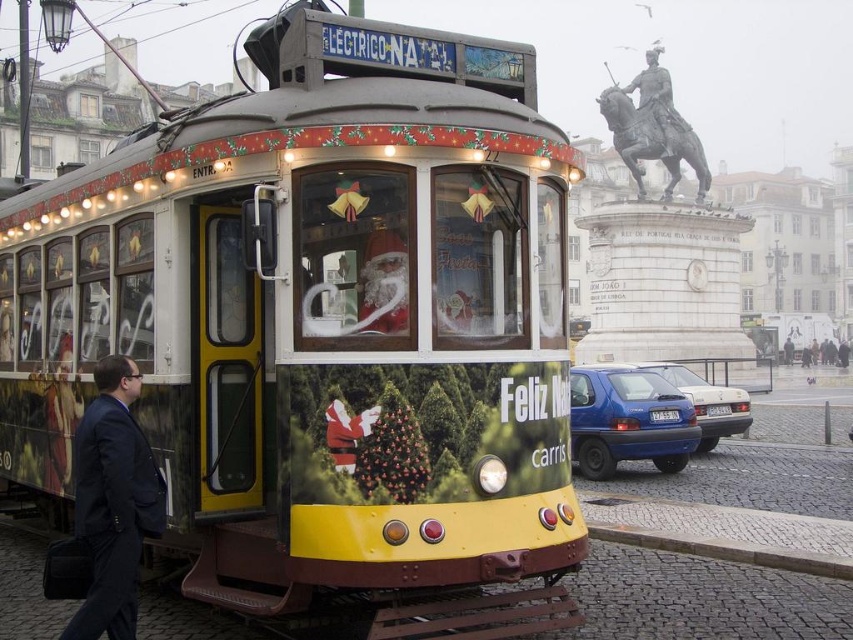
You are a photographer standing in front of the festive streetcar. You want to take a photo that includes both the dark blue suit at left and the red velvet santa at center. Based on their positions, which object should appear higher in the photo?

Answer: The red velvet santa at center appears higher in the photo because the dark blue suit at left is positioned below it.

You are a photographer planning to capture both the bronze statue of man on horse at upper center and the red velvet santa at center in a single frame. Which object should you position closer to the camera to ensure both are fully visible without cropping?

Position the bronze statue of man on horse at upper center closer to the camera since it is wider than the red velvet santa at center, allowing both to fit within the frame without cropping.

In the scene shown: You are a photographer standing in front of the festive streetcar. You notice the dark blue suit at left and the bronze statue of man on horse at upper center. Which object is taller?

The bronze statue of man on horse at upper center is taller than the dark blue suit at left.